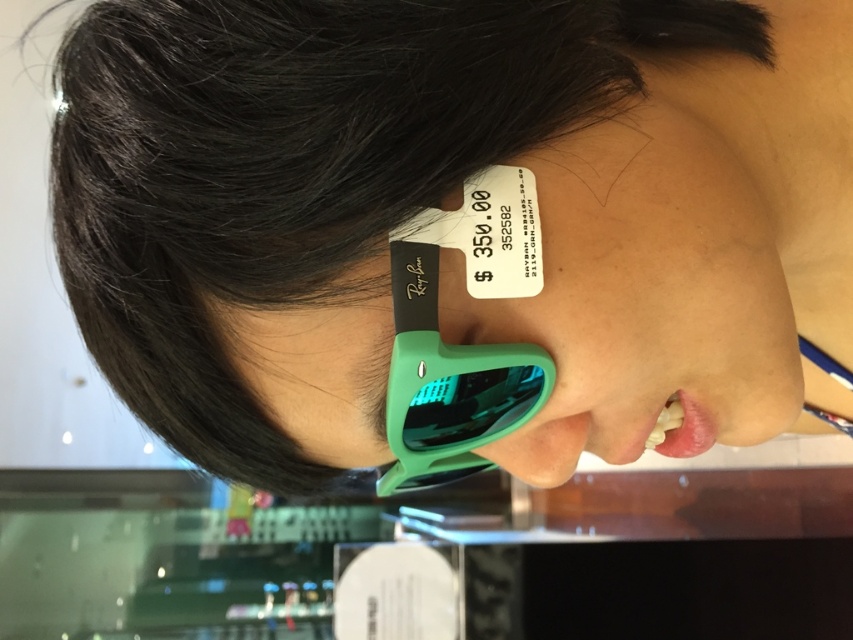
Can you confirm if black matte hair at upper left is positioned to the right of green matte sunglasses at center?

In fact, black matte hair at upper left is to the left of green matte sunglasses at center.

Does black matte hair at upper left have a greater width compared to green matte sunglasses at center?

Yes.

Locate an element on the screen. The height and width of the screenshot is (640, 853). black matte hair at upper left is located at coordinates (300, 163).